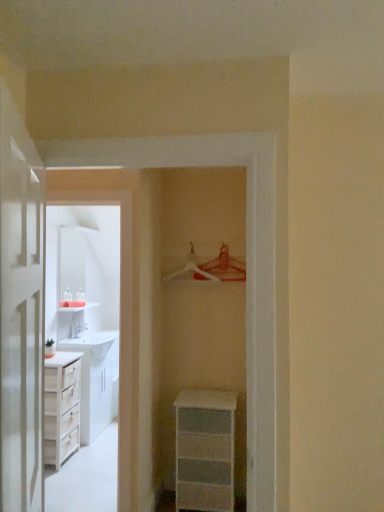
You are a GUI agent. You are given a task and a screenshot of the screen. Output one action in this format:
    pyautogui.click(x=<x>, y=<y>)
    Task: Click on the white plastic hanger at center, acting as the 1th hanger starting from the left
    
    Given the screenshot: What is the action you would take?
    pyautogui.click(x=192, y=269)

Where is `white glossy door at left`? The height and width of the screenshot is (512, 384). white glossy door at left is located at coordinates (21, 313).

Where is `metallic silver hanger at upper center, the 1th hanger positioned from the right`? This screenshot has height=512, width=384. metallic silver hanger at upper center, the 1th hanger positioned from the right is located at coordinates (222, 268).

Find the location of a particular element. Image resolution: width=384 pixels, height=512 pixels. white wood cabinet at left is located at coordinates (120, 322).

From a real-world perspective, who is located higher, white plastic chest of drawers at lower center or white wood cabinet at left?

white wood cabinet at left, from a real-world perspective.

Is white plastic chest of drawers at lower center outside of white wood cabinet at left?

Yes, white plastic chest of drawers at lower center is located beyond the bounds of white wood cabinet at left.

How different are the orientations of white plastic chest of drawers at lower center and white wood cabinet at left in degrees?

There is a 0.0178-degree angle between the facing directions of white plastic chest of drawers at lower center and white wood cabinet at left.

From the image's perspective, is white plastic chest of drawers at lower center located above white wood cabinet at left?

No.

This screenshot has height=512, width=384. Find the location of `hanger behind the white plastic hanger at center, acting as the 1th hanger starting from the left`. hanger behind the white plastic hanger at center, acting as the 1th hanger starting from the left is located at coordinates (222, 268).

Considering the sizes of objects white plastic hanger at center, arranged as the second hanger when viewed from the right, and metallic silver hanger at upper center, the 1th hanger positioned from the right, in the image provided, who is wider, white plastic hanger at center, arranged as the second hanger when viewed from the right, or metallic silver hanger at upper center, the 1th hanger positioned from the right,?

white plastic hanger at center, arranged as the second hanger when viewed from the right, is wider.

From the image's perspective, which object appears higher, white plastic hanger at center, acting as the 1th hanger starting from the left, or metallic silver hanger at upper center, the 1th hanger positioned from the right?

white plastic hanger at center, acting as the 1th hanger starting from the left.

Measure the distance from white plastic hanger at center, acting as the 1th hanger starting from the left, to metallic silver hanger at upper center, the second hanger from the left.

They are 3.39 inches apart.

In terms of size, does white glossy door at left appear bigger or smaller than metallic silver hanger at upper center, the 1th hanger positioned from the right?

Considering their sizes, white glossy door at left takes up more space than metallic silver hanger at upper center, the 1th hanger positioned from the right.

From the image's perspective, is white glossy door at left located beneath metallic silver hanger at upper center, the second hanger from the left?

Yes, from the image's perspective, white glossy door at left is below metallic silver hanger at upper center, the second hanger from the left.

Which is correct: white glossy door at left is inside metallic silver hanger at upper center, the 1th hanger positioned from the right, or outside of it?

white glossy door at left lies outside metallic silver hanger at upper center, the 1th hanger positioned from the right.

In the image, is white glossy door at left positioned in front of or behind metallic silver hanger at upper center, the 1th hanger positioned from the right?

In the image, white glossy door at left appears in front of metallic silver hanger at upper center, the 1th hanger positioned from the right.

Identify the location of corridor that appears below the metallic silver hanger at upper center, the second hanger from the left (from the image's perspective). The width and height of the screenshot is (384, 512). (120, 322).

Which is more to the left, metallic silver hanger at upper center, the 1th hanger positioned from the right, or white wood cabinet at left?

Positioned to the left is white wood cabinet at left.

Does point (240, 273) appear closer or farther from the camera than point (124, 281)?

Clearly, point (240, 273) is more distant from the camera than point (124, 281).

Considering the sizes of objects metallic silver hanger at upper center, the second hanger from the left, and white wood cabinet at left in the image provided, who is bigger, metallic silver hanger at upper center, the second hanger from the left, or white wood cabinet at left?

Bigger between the two is white wood cabinet at left.

This screenshot has height=512, width=384. What are the coordinates of `hanger above the metallic silver hanger at upper center, the second hanger from the left (from a real-world perspective)` in the screenshot? It's located at (192, 269).

From a real-world perspective, is metallic silver hanger at upper center, the 1th hanger positioned from the right, positioned over white plastic hanger at center, acting as the 1th hanger starting from the left, based on gravity?

Incorrect, from a real-world perspective, metallic silver hanger at upper center, the 1th hanger positioned from the right, is lower than white plastic hanger at center, acting as the 1th hanger starting from the left.

Is metallic silver hanger at upper center, the second hanger from the left, at the right side of white plastic hanger at center, arranged as the second hanger when viewed from the right?

Indeed, metallic silver hanger at upper center, the second hanger from the left, is positioned on the right side of white plastic hanger at center, arranged as the second hanger when viewed from the right.

Can you see metallic silver hanger at upper center, the second hanger from the left, touching white plastic hanger at center, arranged as the second hanger when viewed from the right?

Indeed, metallic silver hanger at upper center, the second hanger from the left, and white plastic hanger at center, arranged as the second hanger when viewed from the right, are beside each other and touching.

How different are the orientations of white wood cabinet at left and white glossy door at left in degrees?

The angle between the facing direction of white wood cabinet at left and the facing direction of white glossy door at left is 114 degrees.

From the image's perspective, between white wood cabinet at left and white glossy door at left, which one is located above?

From the image's view, white glossy door at left is above.

From their relative heights in the image, would you say white wood cabinet at left is taller or shorter than white glossy door at left?

Clearly, white wood cabinet at left is taller compared to white glossy door at left.

Does white wood cabinet at left touch white glossy door at left?

They are not placed beside each other.

In terms of width, does white plastic chest of drawers at lower center look wider or thinner when compared to white plastic hanger at center, arranged as the second hanger when viewed from the right?

In the image, white plastic chest of drawers at lower center appears to be wider than white plastic hanger at center, arranged as the second hanger when viewed from the right.

Is point (230, 407) positioned in front of point (202, 271)?

Yes, point (230, 407) is closer to viewer.

From a real-world perspective, is white plastic chest of drawers at lower center located beneath white plastic hanger at center, acting as the 1th hanger starting from the left?

Indeed, from a real-world perspective, white plastic chest of drawers at lower center is positioned beneath white plastic hanger at center, acting as the 1th hanger starting from the left.

Find the location of `corridor above the white plastic chest of drawers at lower center (from the image's perspective)`. corridor above the white plastic chest of drawers at lower center (from the image's perspective) is located at coordinates (120, 322).

Identify the location of hanger above the metallic silver hanger at upper center, the second hanger from the left (from a real-world perspective). (192, 269).

Considering their positions, is white plastic chest of drawers at lower center positioned further to white wood cabinet at left than white glossy door at left?

white glossy door at left is further to white wood cabinet at left.

Estimate the real-world distances between objects in this image. Which object is further from white plastic chest of drawers at lower center, white glossy door at left or white wood cabinet at left?

white glossy door at left.

When comparing their distances from white wood cabinet at left, does white glossy door at left or metallic silver hanger at upper center, the second hanger from the left, seem closer?

The object closer to white wood cabinet at left is metallic silver hanger at upper center, the second hanger from the left.

Looking at the image, which one is located further to metallic silver hanger at upper center, the second hanger from the left, white plastic chest of drawers at lower center or white plastic hanger at center, arranged as the second hanger when viewed from the right?

white plastic chest of drawers at lower center.

When comparing their distances from white glossy door at left, does white plastic hanger at center, acting as the 1th hanger starting from the left, or white plastic chest of drawers at lower center seem further?

The object further to white glossy door at left is white plastic hanger at center, acting as the 1th hanger starting from the left.

Based on their spatial positions, is white wood cabinet at left or white plastic hanger at center, acting as the 1th hanger starting from the left, further from white plastic chest of drawers at lower center?

white plastic hanger at center, acting as the 1th hanger starting from the left, is positioned further to the anchor white plastic chest of drawers at lower center.

Estimate the real-world distances between objects in this image. Which object is closer to white glossy door at left, metallic silver hanger at upper center, the second hanger from the left, or white wood cabinet at left?

white wood cabinet at left lies closer to white glossy door at left than the other object.

From the image, which object appears to be nearer to white plastic hanger at center, arranged as the second hanger when viewed from the right, metallic silver hanger at upper center, the second hanger from the left, or white wood cabinet at left?

metallic silver hanger at upper center, the second hanger from the left, is positioned closer to the anchor white plastic hanger at center, arranged as the second hanger when viewed from the right.

Find the location of a particular element. corridor that lies between metallic silver hanger at upper center, the 1th hanger positioned from the right, and white plastic chest of drawers at lower center from top to bottom is located at coordinates (120, 322).

At what (x,y) coordinates should I click in order to perform the action: click on corridor that lies between white plastic hanger at center, arranged as the second hanger when viewed from the right, and white plastic chest of drawers at lower center from top to bottom. Please return your answer as a coordinate pair (x, y). Looking at the image, I should click on (120, 322).

I want to click on corridor between white glossy door at left and metallic silver hanger at upper center, the 1th hanger positioned from the right, from front to back, so click(120, 322).

This screenshot has width=384, height=512. I want to click on corridor positioned between white glossy door at left and white plastic chest of drawers at lower center from near to far, so click(x=120, y=322).